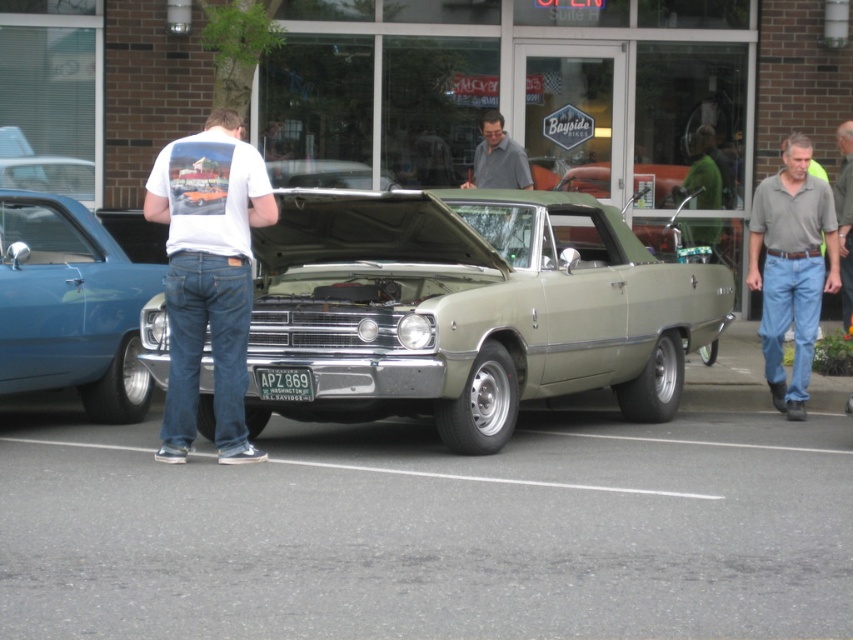
Which is above, light green metallic car at center or green metallic license plate at center?

Positioned higher is light green metallic car at center.

Which is more to the left, light green metallic car at center or green metallic license plate at center?

green metallic license plate at center is more to the left.

Who is more forward, (250, 400) or (291, 371)?

Positioned in front is point (291, 371).

Locate an element on the screen. light green metallic car at center is located at coordinates (469, 308).

Who is shorter, light green metallic car at center or gray fabric shirt at right?

light green metallic car at center

Is point (526, 260) positioned after point (846, 193)?

No, (526, 260) is in front of (846, 193).

You are a GUI agent. You are given a task and a screenshot of the screen. Output one action in this format:
    pyautogui.click(x=<x>, y=<y>)
    Task: Click on the light green metallic car at center
    The width and height of the screenshot is (853, 640).
    Given the screenshot: What is the action you would take?
    pyautogui.click(x=469, y=308)

The image size is (853, 640). I want to click on light green metallic car at center, so (469, 308).

Can you confirm if light green metallic car at center is wider than white cotton t-shirt at center?

Yes, light green metallic car at center is wider than white cotton t-shirt at center.

Who is higher up, light green metallic car at center or white cotton t-shirt at center?

Positioned higher is white cotton t-shirt at center.

The width and height of the screenshot is (853, 640). I want to click on light green metallic car at center, so point(469,308).